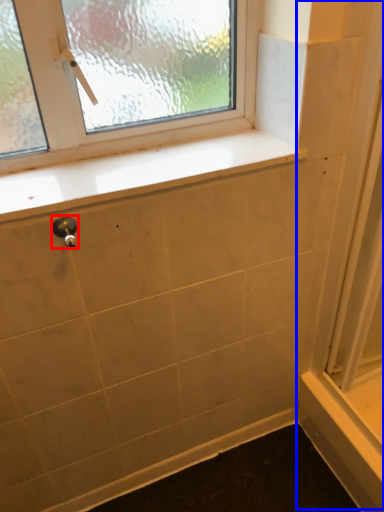
Question: Which of the following is the farthest to the observer, door handle (highlighted by a red box) or screen door (highlighted by a blue box)?

Choices:
 (A) door handle
 (B) screen door

Answer: (A)